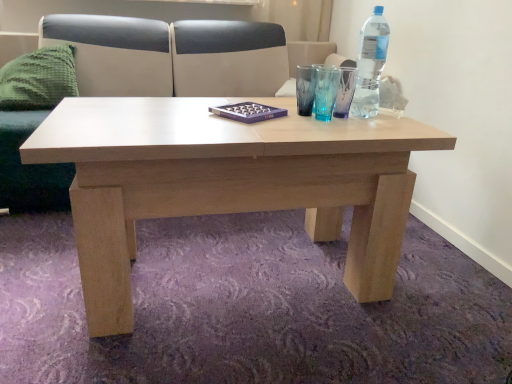
This screenshot has width=512, height=384. Find the location of `clear plastic bottle at upper right`. clear plastic bottle at upper right is located at coordinates (370, 64).

What do you see at coordinates (370, 64) in the screenshot? This screenshot has width=512, height=384. I see `clear plastic bottle at upper right` at bounding box center [370, 64].

Identify the location of clear plastic bottle at upper right. (370, 64).

Is green knitted pillow at left oriented away from clear plastic bottle at upper right?

That's not correct — green knitted pillow at left is not looking away from clear plastic bottle at upper right.

Who is smaller, green knitted pillow at left or clear plastic bottle at upper right?

Smaller between the two is clear plastic bottle at upper right.

In terms of width, does green knitted pillow at left look wider or thinner when compared to clear plastic bottle at upper right?

Clearly, green knitted pillow at left has more width compared to clear plastic bottle at upper right.

Does green knitted pillow at left appear on the right side of clear plastic bottle at upper right?

Incorrect, green knitted pillow at left is not on the right side of clear plastic bottle at upper right.

Does clear plastic bottle at upper right have a greater height compared to light beige leather couch at upper center?

In fact, clear plastic bottle at upper right may be shorter than light beige leather couch at upper center.

Considering the positions of objects clear plastic bottle at upper right and light beige leather couch at upper center in the image provided, who is more to the left, clear plastic bottle at upper right or light beige leather couch at upper center?

light beige leather couch at upper center is more to the left.

Is clear plastic bottle at upper right far away from light beige leather couch at upper center?

Yes, clear plastic bottle at upper right and light beige leather couch at upper center are located far from each other.

Is clear plastic bottle at upper right inside the boundaries of light beige leather couch at upper center, or outside?

The correct answer is: outside.

Which is behind, clear plastic bottle at upper right or green knitted pillow at left?

green knitted pillow at left.

Locate an element on the screen. The image size is (512, 384). bottle located on the right of green knitted pillow at left is located at coordinates (370, 64).

Is clear plastic bottle at upper right smaller than green knitted pillow at left?

Correct, clear plastic bottle at upper right occupies less space than green knitted pillow at left.

Is clear plastic bottle at upper right not close to green knitted pillow at left?

That's right, there is a large distance between clear plastic bottle at upper right and green knitted pillow at left.

Is point (213, 63) less distant than point (29, 85)?

That is False.

From the picture: From the image's perspective, is light beige leather couch at upper center located above or below green knitted pillow at left?

Based on their image positions, light beige leather couch at upper center is located beneath green knitted pillow at left.

Considering the relative sizes of light beige leather couch at upper center and green knitted pillow at left in the image provided, is light beige leather couch at upper center thinner than green knitted pillow at left?

In fact, light beige leather couch at upper center might be wider than green knitted pillow at left.

Between light beige leather couch at upper center and green knitted pillow at left, which one has smaller size?

Smaller between the two is green knitted pillow at left.

Which is behind, point (38, 53) or point (141, 81)?

The point (141, 81) is behind.

Between green knitted pillow at left and light beige leather couch at upper center, which one has smaller width?

Thinner between the two is green knitted pillow at left.

Is green knitted pillow at left beside light beige leather couch at upper center?

They are not placed beside each other.

Does green knitted pillow at left contain light beige leather couch at upper center?

Definitely not — light beige leather couch at upper center is not inside green knitted pillow at left.

Are light beige leather couch at upper center and clear plastic bottle at upper right located far from each other?

Yes.

From a real-world perspective, does light beige leather couch at upper center stand above clear plastic bottle at upper right?

No, from a real-world perspective, light beige leather couch at upper center is not above clear plastic bottle at upper right.

From the picture: Considering the sizes of light beige leather couch at upper center and clear plastic bottle at upper right in the image, is light beige leather couch at upper center bigger or smaller than clear plastic bottle at upper right?

In the image, light beige leather couch at upper center appears to be larger than clear plastic bottle at upper right.

Between light beige leather couch at upper center and clear plastic bottle at upper right, which one is positioned in front?

clear plastic bottle at upper right is closer to the camera.

The height and width of the screenshot is (384, 512). Identify the location of pillow that is above the clear plastic bottle at upper right (from the image's perspective). (38, 79).

This screenshot has width=512, height=384. What are the coordinates of `bottle in front of the light beige leather couch at upper center` in the screenshot? It's located at (370, 64).

Consider the image. Estimate the real-world distances between objects in this image. Which object is closer to light beige leather couch at upper center, green knitted pillow at left or clear plastic bottle at upper right?

Based on the image, green knitted pillow at left appears to be nearer to light beige leather couch at upper center.

Based on their spatial positions, is light beige leather couch at upper center or green knitted pillow at left further from clear plastic bottle at upper right?

green knitted pillow at left is further to clear plastic bottle at upper right.

Looking at the image, which one is located further to green knitted pillow at left, light beige leather couch at upper center or clear plastic bottle at upper right?

Among the two, clear plastic bottle at upper right is located further to green knitted pillow at left.

When comparing their distances from clear plastic bottle at upper right, does green knitted pillow at left or light beige leather couch at upper center seem closer?

Based on the image, light beige leather couch at upper center appears to be nearer to clear plastic bottle at upper right.

From the picture: From the image, which object appears to be farther from light beige leather couch at upper center, clear plastic bottle at upper right or green knitted pillow at left?

clear plastic bottle at upper right lies further to light beige leather couch at upper center than the other object.

From the picture: Estimate the real-world distances between objects in this image. Which object is further from green knitted pillow at left, clear plastic bottle at upper right or light beige leather couch at upper center?

clear plastic bottle at upper right is positioned further to the anchor green knitted pillow at left.

Where is `couch between green knitted pillow at left and clear plastic bottle at upper right in the horizontal direction`? This screenshot has width=512, height=384. couch between green knitted pillow at left and clear plastic bottle at upper right in the horizontal direction is located at coordinates (172, 55).